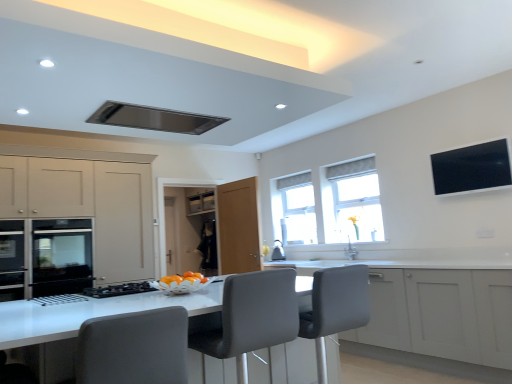
Question: Does transparent glass window at center, which is the 2th window from front to back, have a larger size compared to gray fabric swivel chair at center, the second swivel chair from the right?

Choices:
 (A) yes
 (B) no

Answer: (B)

Question: Is transparent glass window at center, which is counted as the 1th window, starting from the left, positioned before gray fabric swivel chair at center, the second swivel chair from the right?

Choices:
 (A) yes
 (B) no

Answer: (B)

Question: Considering the relative positions of transparent glass window at center, which is the 2th window from front to back, and gray fabric swivel chair at center, marked as the 2th swivel chair in a back-to-front arrangement, in the image provided, is transparent glass window at center, which is the 2th window from front to back, to the right of gray fabric swivel chair at center, marked as the 2th swivel chair in a back-to-front arrangement, from the viewer's perspective?

Choices:
 (A) no
 (B) yes

Answer: (B)

Question: Is transparent glass window at center, which is the 2th window from front to back, taller than gray fabric swivel chair at center, marked as the 2th swivel chair in a back-to-front arrangement?

Choices:
 (A) yes
 (B) no

Answer: (A)

Question: Does transparent glass window at center, which is the 2th window from front to back, have a lesser width compared to gray fabric swivel chair at center, marked as the 2th swivel chair in a back-to-front arrangement?

Choices:
 (A) yes
 (B) no

Answer: (A)

Question: From a real-world perspective, relative to black glossy tv at upper right, is matte black oven at left vertically above or below?

Choices:
 (A) below
 (B) above

Answer: (A)

Question: Is matte black oven at left bigger or smaller than black glossy tv at upper right?

Choices:
 (A) small
 (B) big

Answer: (B)

Question: From the image's perspective, is matte black oven at left positioned above or below black glossy tv at upper right?

Choices:
 (A) above
 (B) below

Answer: (B)

Question: Does point 9,261 appear closer or farther from the camera than point 507,162?

Choices:
 (A) closer
 (B) farther

Answer: (B)

Question: From the image's perspective, is matte black oven at left located above or below grey fabric chair at center?

Choices:
 (A) above
 (B) below

Answer: (A)

Question: Considering their positions, is matte black oven at left located in front of or behind grey fabric chair at center?

Choices:
 (A) behind
 (B) front

Answer: (A)

Question: Is matte black oven at left inside the boundaries of grey fabric chair at center, or outside?

Choices:
 (A) outside
 (B) inside

Answer: (A)

Question: Is matte black oven at left wider or thinner than grey fabric chair at center?

Choices:
 (A) wide
 (B) thin

Answer: (B)

Question: Considering the positions of transparent glass window at center, which is counted as the 1th window, starting from the left, and matte beige cabinet at left, the 1th cabinetry from the left, in the image, is transparent glass window at center, which is counted as the 1th window, starting from the left, taller or shorter than matte beige cabinet at left, the 1th cabinetry from the left,?

Choices:
 (A) tall
 (B) short

Answer: (B)

Question: Is transparent glass window at center, the second window when ordered from right to left, in front of or behind matte beige cabinet at left, arranged as the 2th cabinetry when viewed from the right, in the image?

Choices:
 (A) behind
 (B) front

Answer: (A)